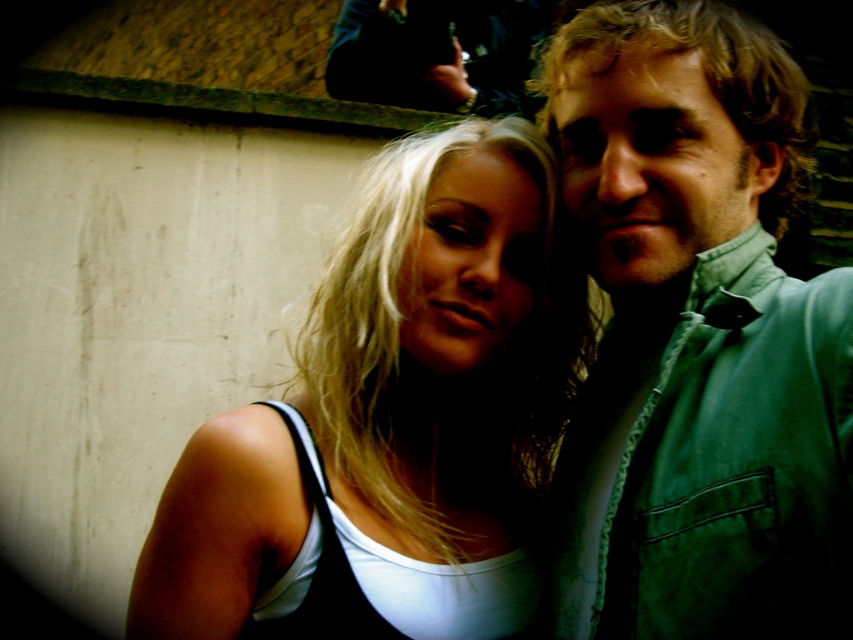
Describe the element at coordinates (695, 339) in the screenshot. I see `green textured shirt at right` at that location.

Measure the distance between green textured shirt at right and white matte tank top at center.

green textured shirt at right and white matte tank top at center are 7.40 inches apart.

Is point (674, 481) closer to viewer compared to point (361, 243)?

That is True.

Image resolution: width=853 pixels, height=640 pixels. Find the location of `green textured shirt at right`. green textured shirt at right is located at coordinates (695, 339).